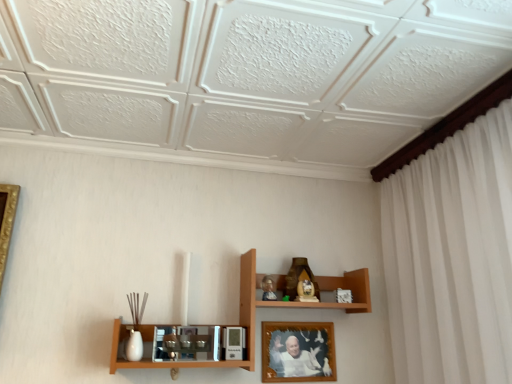
Question: Is matte brown statue at upper center to the left of wooden photo frame at center from the viewer's perspective?

Choices:
 (A) no
 (B) yes

Answer: (A)

Question: Is matte brown statue at upper center in contact with wooden photo frame at center?

Choices:
 (A) yes
 (B) no

Answer: (B)

Question: Can you confirm if matte brown statue at upper center is taller than wooden photo frame at center?

Choices:
 (A) yes
 (B) no

Answer: (B)

Question: Is matte brown statue at upper center turned away from wooden photo frame at center?

Choices:
 (A) no
 (B) yes

Answer: (A)

Question: From a real-world perspective, is matte brown statue at upper center over wooden photo frame at center?

Choices:
 (A) yes
 (B) no

Answer: (A)

Question: Can wooden photo frame at center be found inside matte brown statue at upper center?

Choices:
 (A) no
 (B) yes

Answer: (A)

Question: Considering the relative sizes of wooden photo frame at center and wooden shelf at center in the image provided, is wooden photo frame at center taller than wooden shelf at center?

Choices:
 (A) yes
 (B) no

Answer: (B)

Question: From a real-world perspective, is wooden photo frame at center located beneath wooden shelf at center?

Choices:
 (A) no
 (B) yes

Answer: (B)

Question: Does wooden photo frame at center have a lesser height compared to wooden shelf at center?

Choices:
 (A) yes
 (B) no

Answer: (A)

Question: Is wooden photo frame at center placed right next to wooden shelf at center?

Choices:
 (A) no
 (B) yes

Answer: (A)

Question: Can you confirm if wooden photo frame at center is bigger than wooden shelf at center?

Choices:
 (A) yes
 (B) no

Answer: (B)

Question: Considering the relative positions of wooden photo frame at center and wooden shelf at center in the image provided, is wooden photo frame at center to the right of wooden shelf at center from the viewer's perspective?

Choices:
 (A) no
 (B) yes

Answer: (B)

Question: Would you say wooden photo frame at center is part of wooden shelf at center's contents?

Choices:
 (A) yes
 (B) no

Answer: (A)